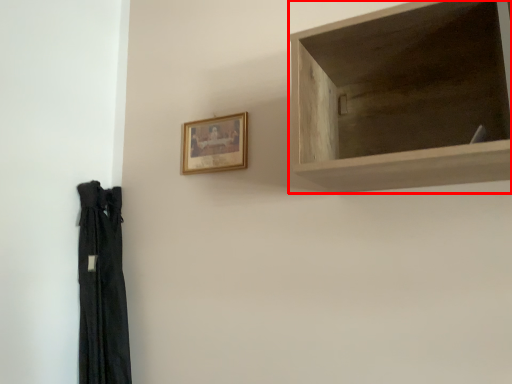
Question: Observing the image, what is the correct spatial positioning of shelf (annotated by the red box) in reference to picture frame?

Choices:
 (A) right
 (B) left

Answer: (A)